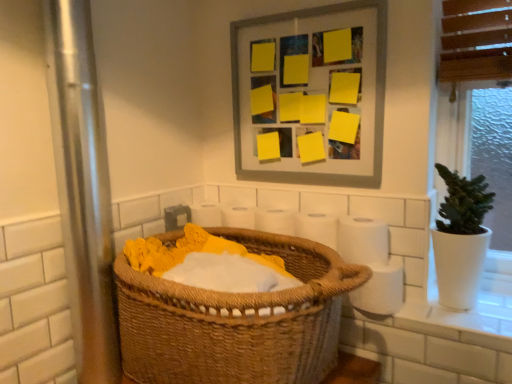
Question: Should I look upward or downward to see matte gray picture frame at upper center?

Choices:
 (A) down
 (B) up

Answer: (B)

Question: Does white paper at center, the 3th toilet paper positioned from the bottom, contain white matte toilet paper at right, the 2th toilet paper positioned from the bottom?

Choices:
 (A) no
 (B) yes

Answer: (A)

Question: Is white paper at center, which appears as the 1th toilet paper when viewed from the top, in contact with white matte toilet paper at right, which is counted as the 2th toilet paper, starting from the top?

Choices:
 (A) yes
 (B) no

Answer: (A)

Question: Can you confirm if white paper at center, which appears as the 1th toilet paper when viewed from the top, is taller than white matte toilet paper at right, which is counted as the 2th toilet paper, starting from the top?

Choices:
 (A) no
 (B) yes

Answer: (B)

Question: From a real-world perspective, is white paper at center, which appears as the 1th toilet paper when viewed from the top, physically below white matte toilet paper at right, the 2th toilet paper positioned from the bottom?

Choices:
 (A) yes
 (B) no

Answer: (A)

Question: Is white paper at center, which appears as the 1th toilet paper when viewed from the top, completely or partially outside of white matte toilet paper at right, which is counted as the 2th toilet paper, starting from the top?

Choices:
 (A) no
 (B) yes

Answer: (B)

Question: Is white paper at center, the 3th toilet paper positioned from the bottom, oriented away from white matte toilet paper at right, which is counted as the 2th toilet paper, starting from the top?

Choices:
 (A) no
 (B) yes

Answer: (A)

Question: Is matte gray picture frame at upper center wider than white paper at center, the 3th toilet paper positioned from the bottom?

Choices:
 (A) no
 (B) yes

Answer: (A)

Question: Can you confirm if matte gray picture frame at upper center is shorter than white paper at center, the 3th toilet paper positioned from the bottom?

Choices:
 (A) yes
 (B) no

Answer: (B)

Question: From a real-world perspective, is matte gray picture frame at upper center physically below white paper at center, which appears as the 1th toilet paper when viewed from the top?

Choices:
 (A) no
 (B) yes

Answer: (A)

Question: Does matte gray picture frame at upper center have a smaller size compared to white paper at center, the 3th toilet paper positioned from the bottom?

Choices:
 (A) yes
 (B) no

Answer: (B)

Question: From the image's perspective, is matte gray picture frame at upper center beneath white paper at center, the 3th toilet paper positioned from the bottom?

Choices:
 (A) no
 (B) yes

Answer: (A)

Question: Can you confirm if matte gray picture frame at upper center is taller than white paper at center, the 3th toilet paper positioned from the bottom?

Choices:
 (A) no
 (B) yes

Answer: (B)

Question: Is white matte toilet paper at right, which is counted as the 2th toilet paper, starting from the top, directly adjacent to matte gray picture frame at upper center?

Choices:
 (A) yes
 (B) no

Answer: (B)